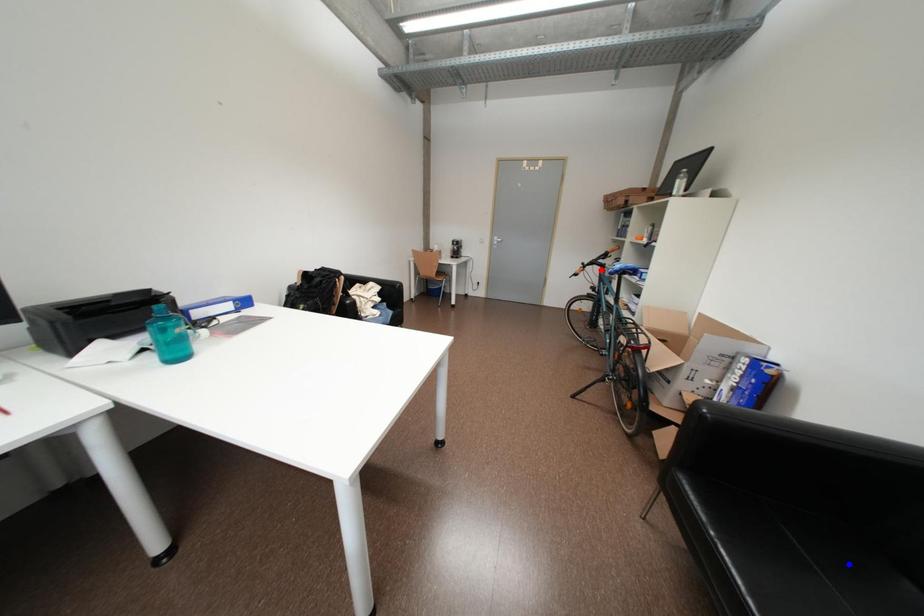
Question: Which of the two points in the image is closer to the camera?

Choices:
 (A) Blue point is closer.
 (B) Red point is closer.

Answer: (A)